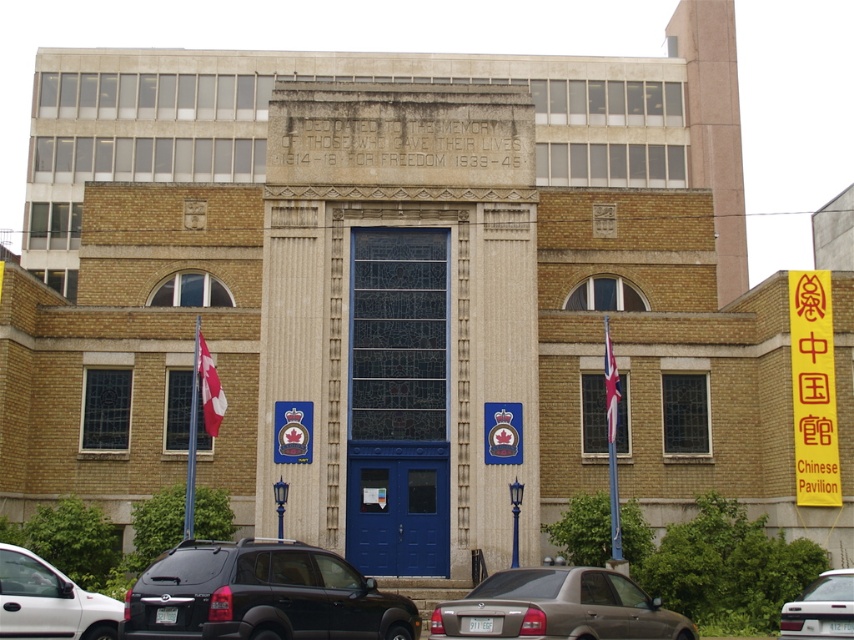
The width and height of the screenshot is (854, 640). Describe the element at coordinates (50, 602) in the screenshot. I see `white matte car at lower left` at that location.

Who is positioned more to the left, white matte car at lower left or red fabric flag at center?

white matte car at lower left

Does point (101, 604) lie behind point (607, 326)?

That is False.

Identify the location of white matte car at lower left. The height and width of the screenshot is (640, 854). (50, 602).

Between white matte car at lower left and red fabric flag at left, which one appears on the left side from the viewer's perspective?

Positioned to the left is white matte car at lower left.

Does white matte car at lower left have a lesser width compared to red fabric flag at left?

No.

Which is in front, point (63, 580) or point (217, 384)?

Point (63, 580) is in front.

Find the location of a particular element. Image resolution: width=854 pixels, height=640 pixels. white matte car at lower left is located at coordinates (50, 602).

Is red fabric flag at left to the left of red fabric flag at center from the viewer's perspective?

Indeed, red fabric flag at left is positioned on the left side of red fabric flag at center.

Who is more forward, [212,406] or [604,324]?

Positioned in front is point [212,406].

You are a GUI agent. You are given a task and a screenshot of the screen. Output one action in this format:
    pyautogui.click(x=<x>, y=<y>)
    Task: Click on the red fabric flag at left
    The height and width of the screenshot is (640, 854).
    Given the screenshot: What is the action you would take?
    pyautogui.click(x=209, y=388)